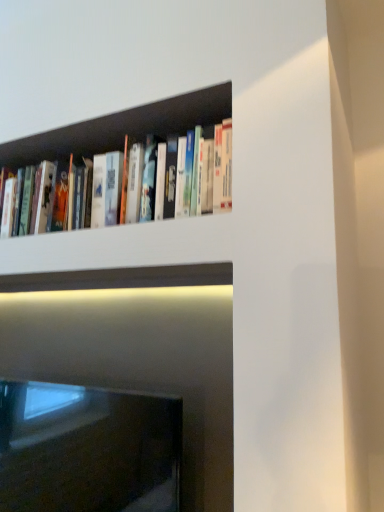
Question: Should I look upward or downward to see black glass fireplace at lower left?

Choices:
 (A) up
 (B) down

Answer: (B)

Question: Is hardcover books at upper left at the left side of black glass fireplace at lower left?

Choices:
 (A) no
 (B) yes

Answer: (A)

Question: Can you confirm if hardcover books at upper left is bigger than black glass fireplace at lower left?

Choices:
 (A) yes
 (B) no

Answer: (B)

Question: Can you confirm if hardcover books at upper left is shorter than black glass fireplace at lower left?

Choices:
 (A) yes
 (B) no

Answer: (A)

Question: Would you consider hardcover books at upper left to be distant from black glass fireplace at lower left?

Choices:
 (A) yes
 (B) no

Answer: (B)

Question: Is hardcover books at upper left oriented towards black glass fireplace at lower left?

Choices:
 (A) yes
 (B) no

Answer: (B)

Question: Is hardcover books at upper left touching black glass fireplace at lower left?

Choices:
 (A) yes
 (B) no

Answer: (B)

Question: Is black glass fireplace at lower left located outside hardcover books at upper left?

Choices:
 (A) no
 (B) yes

Answer: (B)

Question: Can you confirm if black glass fireplace at lower left is positioned to the left of hardcover books at upper left?

Choices:
 (A) no
 (B) yes

Answer: (B)

Question: Can you confirm if black glass fireplace at lower left is shorter than hardcover books at upper left?

Choices:
 (A) no
 (B) yes

Answer: (A)

Question: Is black glass fireplace at lower left positioned in front of hardcover books at upper left?

Choices:
 (A) yes
 (B) no

Answer: (B)

Question: Is black glass fireplace at lower left to the right of hardcover books at upper left from the viewer's perspective?

Choices:
 (A) no
 (B) yes

Answer: (A)

Question: From the image's perspective, is black glass fireplace at lower left on hardcover books at upper left?

Choices:
 (A) yes
 (B) no

Answer: (B)

Question: Considering the relative positions of black glass fireplace at lower left and hardcover books at upper left in the image provided, is black glass fireplace at lower left to the left or to the right of hardcover books at upper left?

Choices:
 (A) right
 (B) left

Answer: (B)